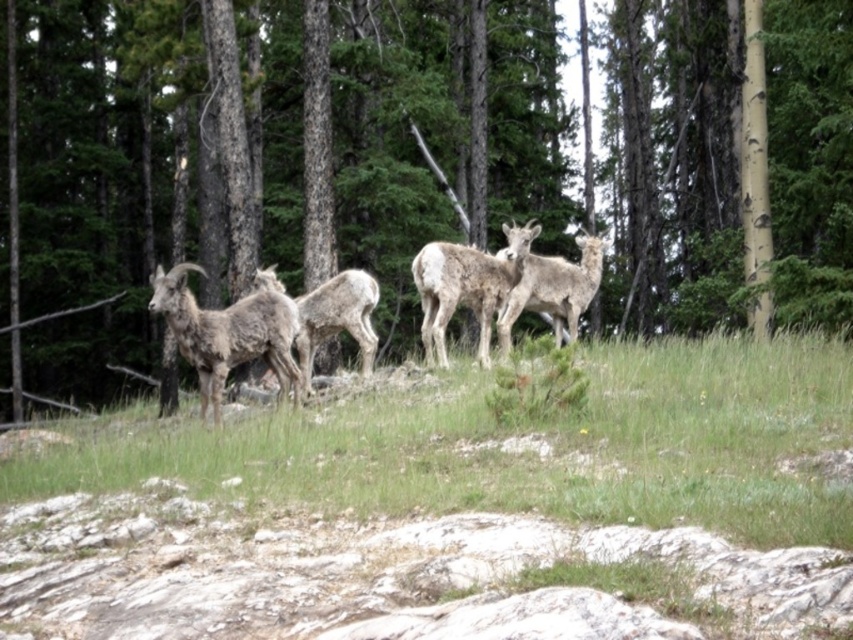
Question: Is gray woolly bighorn sheep at center wider than light brown woolly goat at center?

Choices:
 (A) yes
 (B) no

Answer: (B)

Question: Is green grassy at center wider than gray woolly goat at center?

Choices:
 (A) no
 (B) yes

Answer: (B)

Question: Considering the real-world distances, which object is farthest from the green grassy at center?

Choices:
 (A) gray woolly bighorn sheep at center
 (B) brown textured tree at center

Answer: (B)

Question: Is green grassy at center thinner than light brown woolly goat at center?

Choices:
 (A) no
 (B) yes

Answer: (A)

Question: Which of the following is the closest to the observer?

Choices:
 (A) gray woolly goat at center
 (B) brown woolen goat at center
 (C) light brown woolly goat at center
 (D) fuzzy white goat at center

Answer: (A)

Question: Considering the real-world distances, which object is farthest from the fuzzy white goat at center?

Choices:
 (A) brown woolen goat at center
 (B) brown textured tree at center
 (C) gray woolly bighorn sheep at center

Answer: (B)